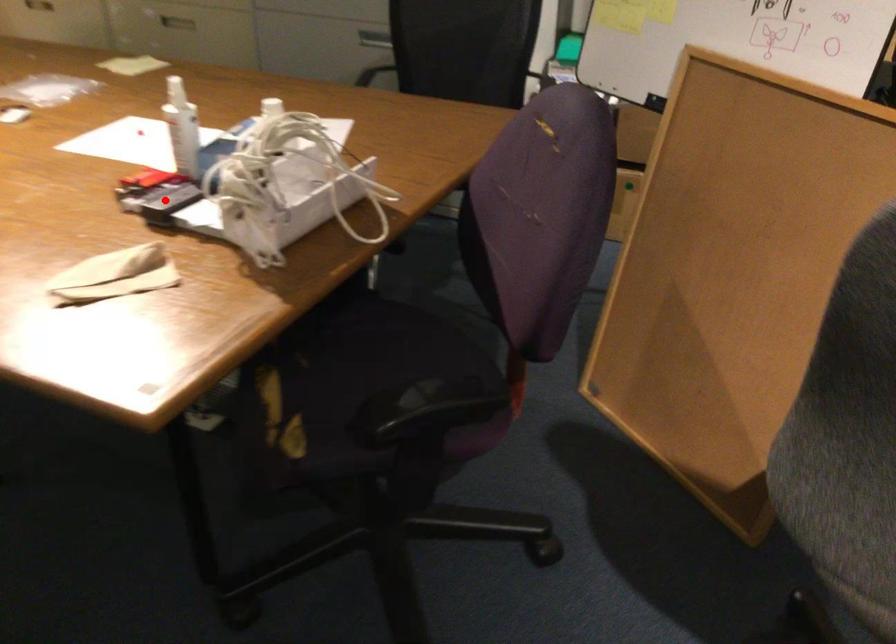
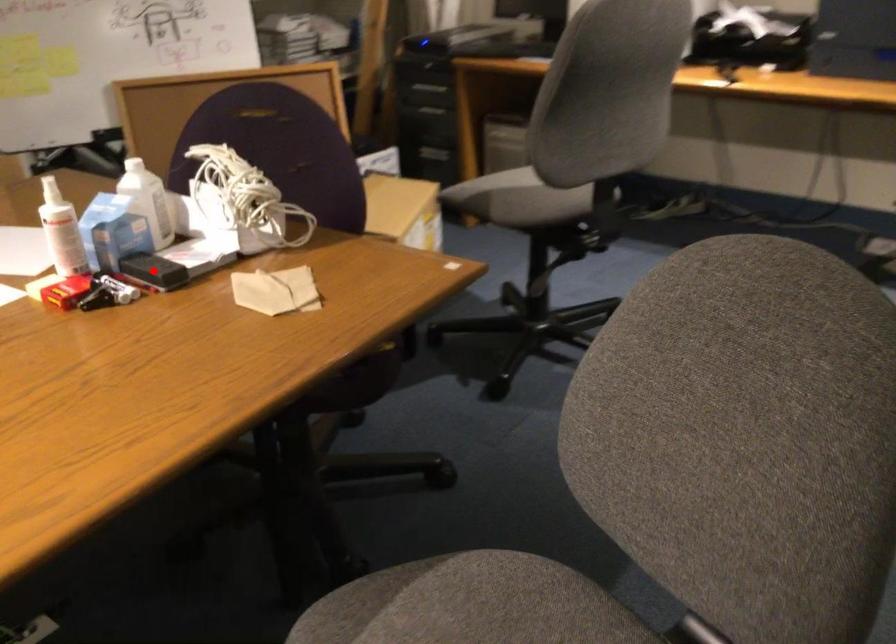
I am providing you with two images of the same scene from different viewpoints. A red point is marked on the first image and another point is marked on the second image. Does the point marked in image1 correspond to the same location as the one in image2?

Yes